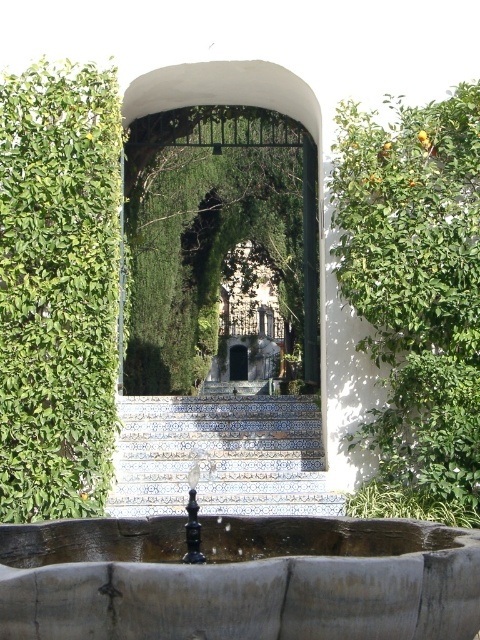
Question: Which point is closer to the camera?

Choices:
 (A) (391, 129)
 (B) (128, 346)

Answer: (A)

Question: Among these objects, which one is nearest to the camera?

Choices:
 (A) green leafy hedge at left
 (B) blue tile stairs at center
 (C) green leafy hedge at right
 (D) green leafy archway at center

Answer: (C)

Question: Does green leafy hedge at left appear on the left side of blue tile stairs at center?

Choices:
 (A) yes
 (B) no

Answer: (A)

Question: Does green leafy hedge at left appear over green leafy archway at center?

Choices:
 (A) yes
 (B) no

Answer: (B)

Question: Which of these objects is positioned closest to the green leafy archway at center?

Choices:
 (A) green leafy hedge at left
 (B) green leafy hedge at right

Answer: (B)

Question: Does green leafy hedge at right have a greater width compared to green leafy archway at center?

Choices:
 (A) yes
 (B) no

Answer: (B)